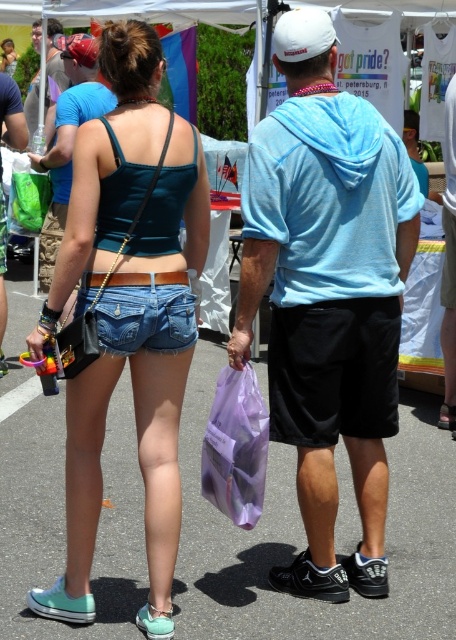
Is matte blue hoodie at center wider than matte blue hoodie at upper center?

Yes.

Which is in front, point (330, 368) or point (92, 113)?

Positioned in front is point (330, 368).

This screenshot has height=640, width=456. In order to click on matte blue hoodie at center in this screenshot , I will do `click(327, 296)`.

Can you confirm if denim shorts at center is shorter than matte plastic cup at upper left?

No, denim shorts at center is not shorter than matte plastic cup at upper left.

Consider the image. Can you confirm if denim shorts at center is smaller than matte plastic cup at upper left?

No, denim shorts at center is not smaller than matte plastic cup at upper left.

Does point (92, 515) come farther from viewer compared to point (32, 104)?

No, (92, 515) is in front of (32, 104).

Find the location of `denim shorts at center`. denim shorts at center is located at coordinates (129, 314).

Which is in front, point (119, 342) or point (30, 86)?

Point (119, 342) is in front.

Between denim shorts at lower center and matte plastic cup at upper left, which one is positioned lower?

denim shorts at lower center

Who is more distant from viewer, (134, 336) or (58, 28)?

The point (58, 28) is more distant.

Identify the location of denim shorts at lower center. (145, 314).